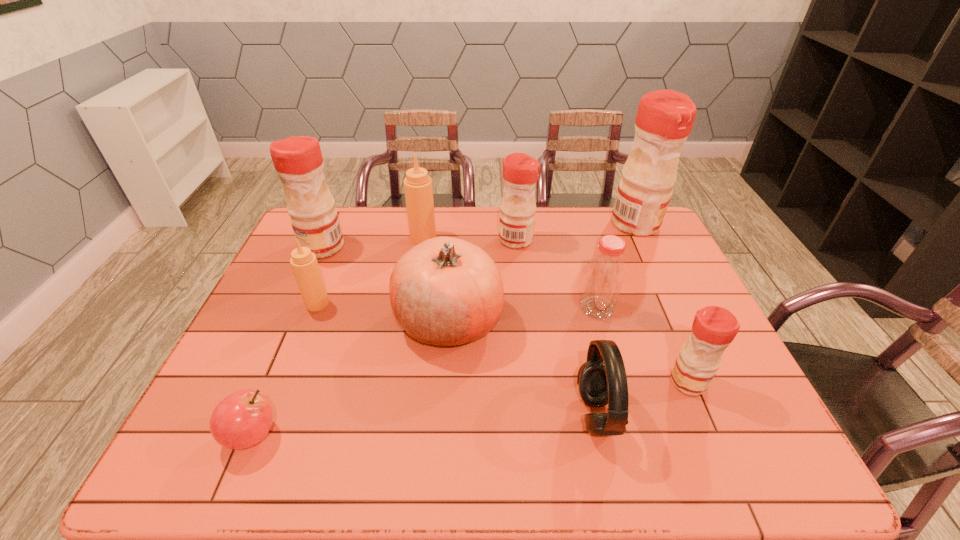
The width and height of the screenshot is (960, 540). In order to click on empty space between the ninth shortest object and the pumpkin in this screenshot , I will do `click(386, 283)`.

Locate an element on the screen. Image resolution: width=960 pixels, height=540 pixels. vacant point located between the tallest condiment and the nearest red condiment is located at coordinates (661, 303).

This screenshot has height=540, width=960. In order to click on vacant point located between the left tan condiment and the nearest red condiment in this screenshot , I will do `click(503, 343)`.

Locate an element on the screen. The image size is (960, 540). free point between the smallest red condiment and the tallest condiment is located at coordinates (661, 303).

Find the location of a particular element. free space between the fifth object from right to left and the fourth condiment from right to left is located at coordinates (469, 239).

Find the location of a particular element. object identified as the eighth closest to the tallest condiment is located at coordinates (304, 264).

Select which object appears as the seventh closest to the pumpkin. Please provide its 2D coordinates. Your answer should be formatted as a tuple, i.e. [(x, y)], where the tuple contains the x and y coordinates of a point satisfying the conditions above.

[(241, 420)]

Locate an element on the screen. This screenshot has height=540, width=960. condiment that stands as the second closest to the farther tan condiment is located at coordinates (298, 161).

Locate which condiment ranks fifth in proximity to the right tan condiment. Please provide its 2D coordinates. Your answer should be formatted as a tuple, i.e. [(x, y)], where the tuple contains the x and y coordinates of a point satisfying the conditions above.

[(714, 328)]

At what (x,y) coordinates should I click in order to perform the action: click on red condiment that stands as the closest to the third biggest red condiment. Please return your answer as a coordinate pair (x, y). The height and width of the screenshot is (540, 960). Looking at the image, I should click on (665, 118).